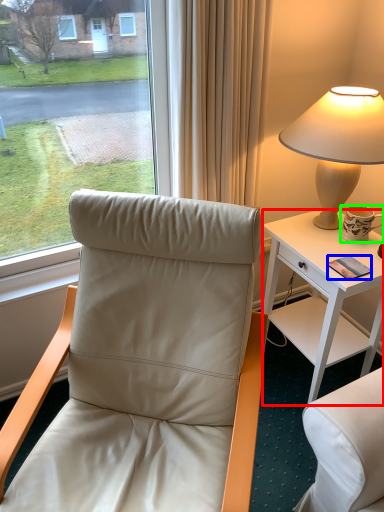
Question: Which object is positioned closest to desk (highlighted by a red box)? Select from mobile phone (highlighted by a blue box) and coffee cup (highlighted by a green box).

Choices:
 (A) mobile phone
 (B) coffee cup

Answer: (B)